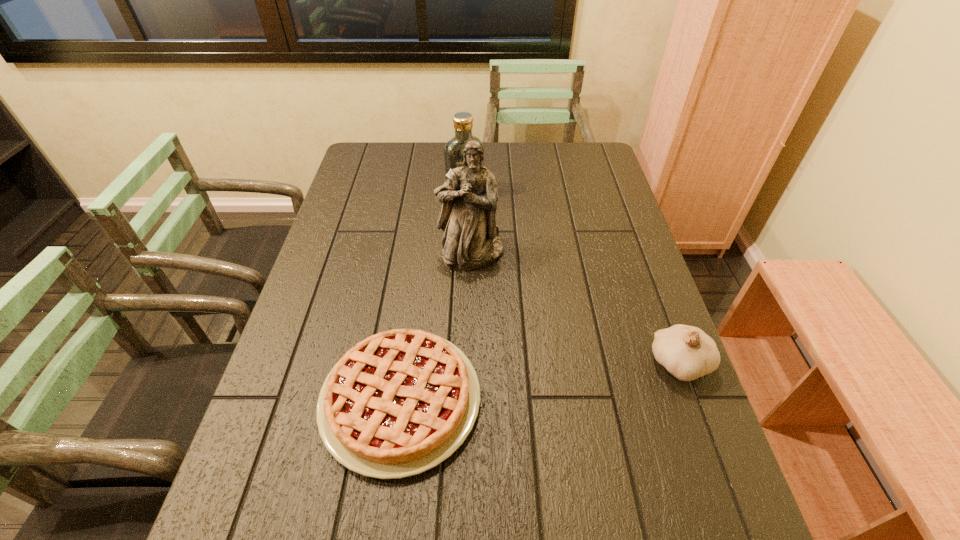
The height and width of the screenshot is (540, 960). What are the coordinates of `pie` in the screenshot? It's located at (x=400, y=402).

Identify the location of garlic. (687, 352).

Where is `the rightmost object`? The width and height of the screenshot is (960, 540). the rightmost object is located at coordinates (687, 352).

At what (x,y) coordinates should I click in order to perform the action: click on the second tallest object. Please return your answer as a coordinate pair (x, y). The image size is (960, 540). Looking at the image, I should click on click(x=453, y=151).

Locate an element on the screen. This screenshot has width=960, height=540. the farthest object is located at coordinates (453, 151).

At what (x,y) coordinates should I click in order to perform the action: click on the tallest object. Please return your answer as a coordinate pair (x, y). Looking at the image, I should click on (469, 197).

Where is `the second farthest object`? Image resolution: width=960 pixels, height=540 pixels. the second farthest object is located at coordinates (469, 197).

Locate an element on the screen. free location located 0.280m on the right of the shortest object is located at coordinates (610, 400).

At what (x,y) coordinates should I click in order to perform the action: click on vacant space located on the front of the garlic. Please return your answer as a coordinate pair (x, y). Looking at the image, I should click on (704, 430).

Find the location of a particular element. The image size is (960, 540). free space located on the front-facing side of the vodka is located at coordinates (498, 242).